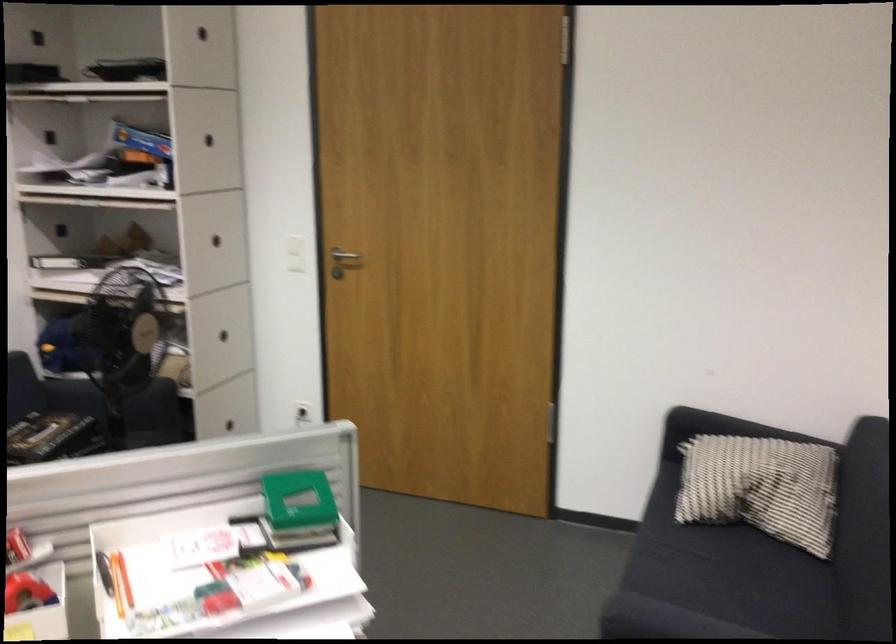
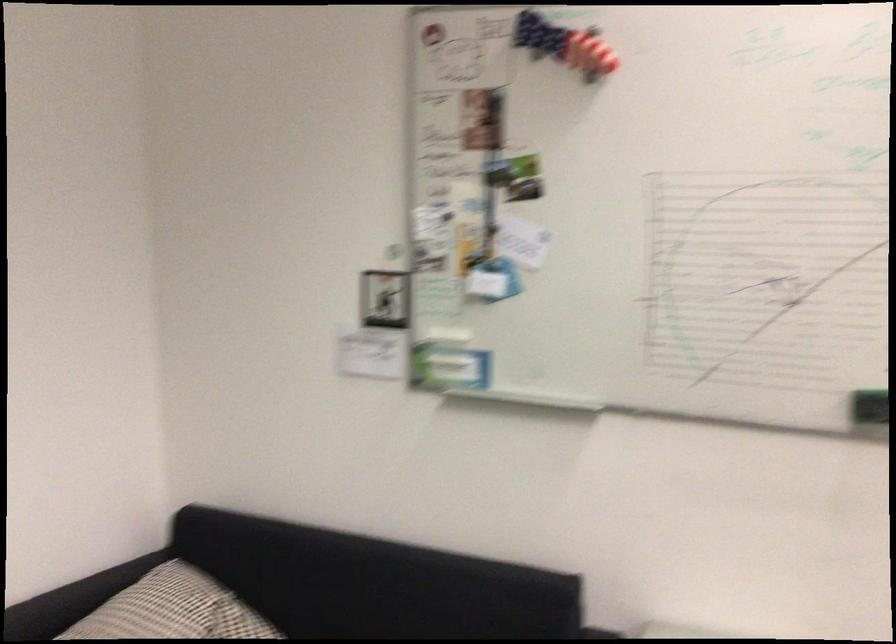
Find the pixel in the second image that matches (764,466) in the first image.

(193, 612)